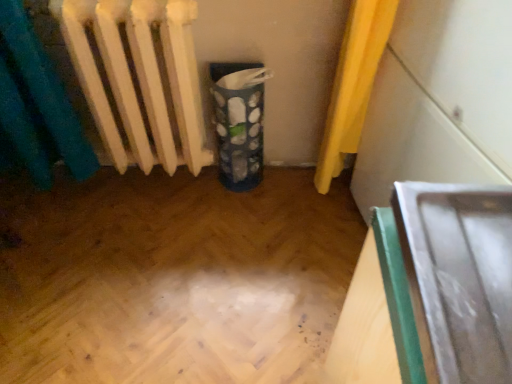
Question: Does white matte radiator at left come in front of blue fabric recycling bin at center?

Choices:
 (A) yes
 (B) no

Answer: (A)

Question: Would you consider white matte radiator at left to be distant from blue fabric recycling bin at center?

Choices:
 (A) yes
 (B) no

Answer: (B)

Question: Is white matte radiator at left not inside blue fabric recycling bin at center?

Choices:
 (A) no
 (B) yes

Answer: (B)

Question: Does white matte radiator at left have a larger size compared to blue fabric recycling bin at center?

Choices:
 (A) no
 (B) yes

Answer: (B)

Question: Does white matte radiator at left have a greater width compared to blue fabric recycling bin at center?

Choices:
 (A) no
 (B) yes

Answer: (B)

Question: From the image's perspective, is white matte radiator at left on blue fabric recycling bin at center?

Choices:
 (A) yes
 (B) no

Answer: (A)

Question: Is metallic silver tray at lower right, which is the first wide from left to right, oriented towards blue fabric recycling bin at center?

Choices:
 (A) no
 (B) yes

Answer: (A)

Question: Does metallic silver tray at lower right, which is the first wide from left to right, contain blue fabric recycling bin at center?

Choices:
 (A) no
 (B) yes

Answer: (A)

Question: Considering the relative sizes of metallic silver tray at lower right, which is the second wide from right to left, and blue fabric recycling bin at center in the image provided, is metallic silver tray at lower right, which is the second wide from right to left, wider than blue fabric recycling bin at center?

Choices:
 (A) yes
 (B) no

Answer: (A)

Question: From the image's perspective, does metallic silver tray at lower right, which is the first wide from left to right, appear lower than blue fabric recycling bin at center?

Choices:
 (A) no
 (B) yes

Answer: (B)

Question: Can you confirm if metallic silver tray at lower right, which is the first wide from left to right, is taller than blue fabric recycling bin at center?

Choices:
 (A) no
 (B) yes

Answer: (B)

Question: Is metallic silver tray at lower right, which is the first wide from left to right, smaller than blue fabric recycling bin at center?

Choices:
 (A) no
 (B) yes

Answer: (A)

Question: From a real-world perspective, is white matte radiator at left positioned over metallic silver tray at right, which appears as the 1th wide when viewed from the right, based on gravity?

Choices:
 (A) no
 (B) yes

Answer: (A)